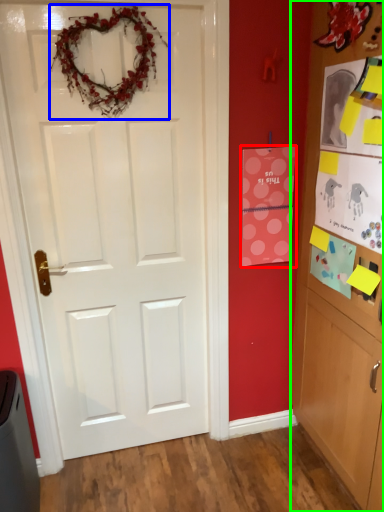
Question: Considering the real-world distances, which object is farthest from postcard (highlighted by a red box)? christmas decoration (highlighted by a blue box) or cabinetry (highlighted by a green box)?

Choices:
 (A) christmas decoration
 (B) cabinetry

Answer: (A)